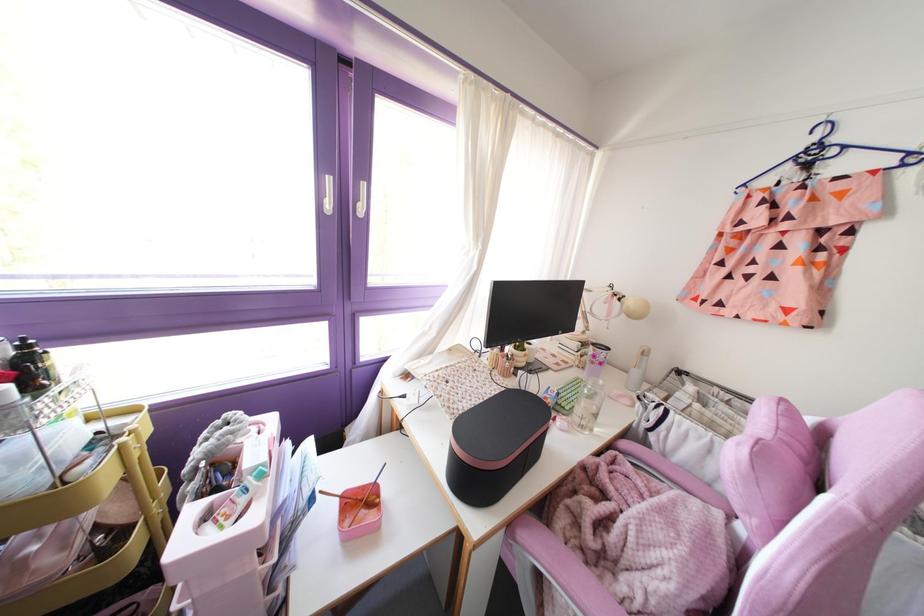
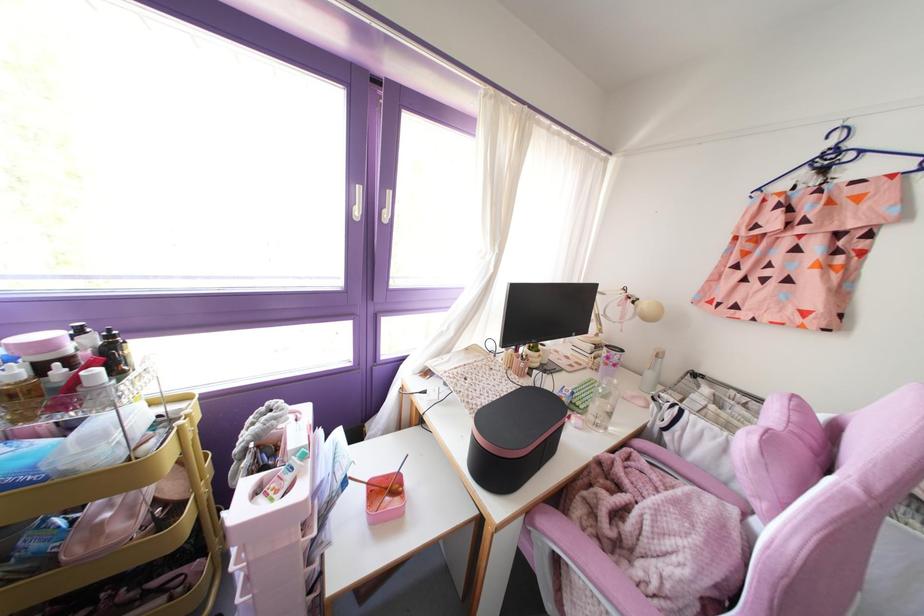
Where in the second image is the point corresponding to point 508,525 from the first image?

(528, 513)